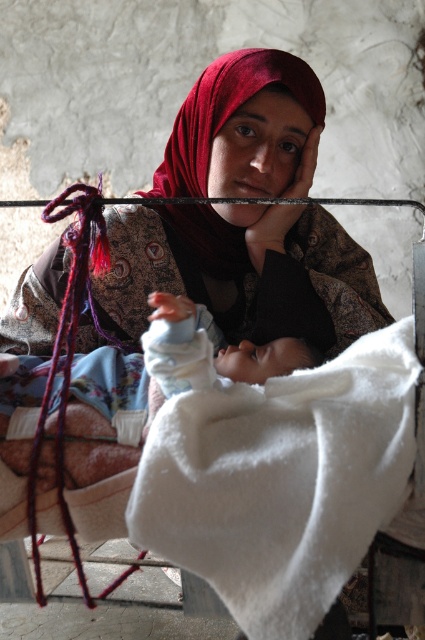
Can you confirm if white fluffy blanket at center is positioned below velvet red headscarf at center?

Yes.

Who is positioned more to the right, white fluffy blanket at center or velvet red headscarf at center?

From the viewer's perspective, white fluffy blanket at center appears more on the right side.

Does point (214, 474) lie in front of point (204, 259)?

Yes, it is.

Locate an element on the screen. white fluffy blanket at center is located at coordinates (283, 481).

How distant is velvet red headscarf at center from light blue fabric at center?

velvet red headscarf at center and light blue fabric at center are 36.43 centimeters apart from each other.

Between velvet red headscarf at center and light blue fabric at center, which one appears on the right side from the viewer's perspective?

velvet red headscarf at center

Between point (271, 61) and point (187, 305), which one is positioned in front?

Point (187, 305) is more forward.

Locate an element on the screen. This screenshot has width=425, height=640. velvet red headscarf at center is located at coordinates (227, 112).

Based on the photo, can you confirm if white fluffy blanket at center is positioned to the left of light blue fabric at center?

No, white fluffy blanket at center is not to the left of light blue fabric at center.

Is white fluffy blanket at center smaller than light blue fabric at center?

No, white fluffy blanket at center is not smaller than light blue fabric at center.

What do you see at coordinates (283, 481) in the screenshot? I see `white fluffy blanket at center` at bounding box center [283, 481].

Where is `white fluffy blanket at center`? The image size is (425, 640). white fluffy blanket at center is located at coordinates (283, 481).